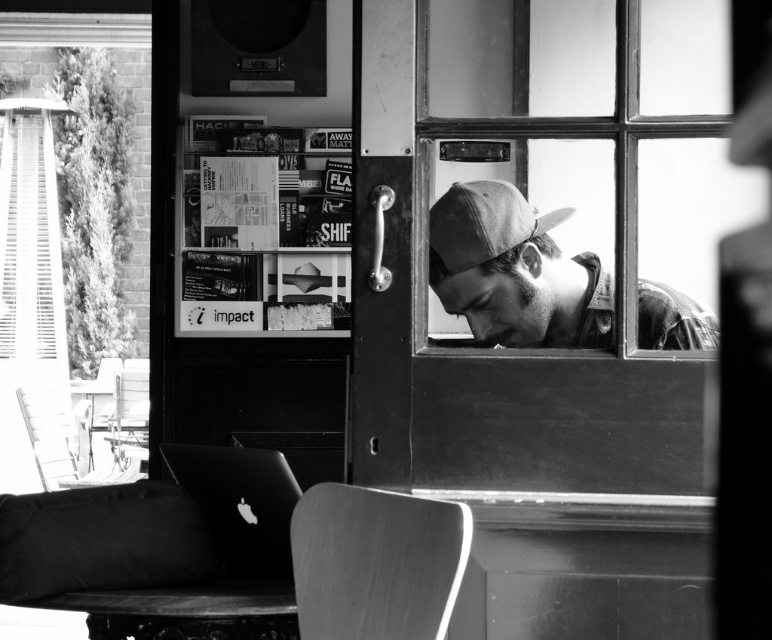
Question: Does printed paper posters at upper center appear over matte gray baseball cap at center?

Choices:
 (A) yes
 (B) no

Answer: (A)

Question: Which point appears farthest from the camera in this image?

Choices:
 (A) (557, 294)
 (B) (261, 609)
 (C) (258, 524)
 (D) (438, 276)

Answer: (C)

Question: Which object appears closest to the camera in this image?

Choices:
 (A) smooth wooden table at lower center
 (B) metallic silver laptop at lower left
 (C) matte brown cap at center
 (D) printed paper posters at upper center

Answer: (C)

Question: Can you confirm if printed paper posters at upper center is positioned above matte brown cap at center?

Choices:
 (A) yes
 (B) no

Answer: (A)

Question: Which of the following is the farthest from the observer?

Choices:
 (A) matte brown cap at center
 (B) printed paper posters at upper center
 (C) black fabric bag at lower left

Answer: (B)

Question: Does matte brown cap at center appear over black fabric bag at lower left?

Choices:
 (A) yes
 (B) no

Answer: (A)